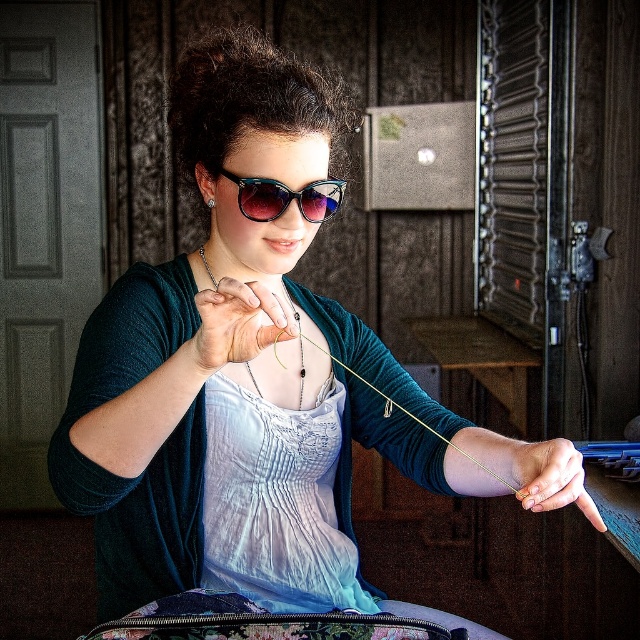
Question: Is gold metallic ring at lower right wider than shiny blue acetate sunglasses at center?

Choices:
 (A) yes
 (B) no

Answer: (B)

Question: Which object is closer to the camera taking this photo?

Choices:
 (A) shiny blue acetate sunglasses at center
 (B) gold metallic ring at lower right
 (C) white cotton apron at center
 (D) matte silver ring at center

Answer: (D)

Question: Which point is farther to the camera?

Choices:
 (A) pos(228,340)
 (B) pos(305,193)
 (C) pos(600,525)

Answer: (B)

Question: Which of the following is the closest to the observer?

Choices:
 (A) gold metallic ring at lower right
 (B) matte silver ring at center

Answer: (B)

Question: Can you confirm if white cotton apron at center is positioned below shiny blue acetate sunglasses at center?

Choices:
 (A) yes
 (B) no

Answer: (A)

Question: Can you confirm if gold metallic ring at lower right is positioned above shiny blue acetate sunglasses at center?

Choices:
 (A) no
 (B) yes

Answer: (A)